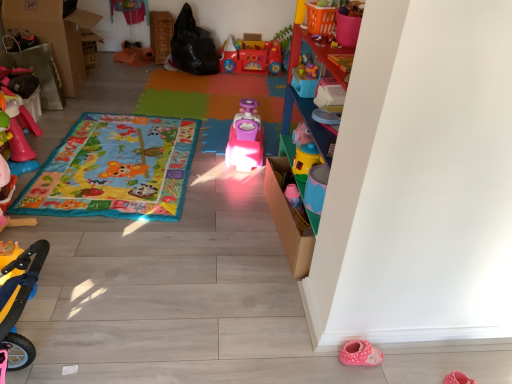
Find the location of a particular element. The height and width of the screenshot is (384, 512). free spot below matte pink car at center, arranged as the second blanket when viewed from the front (from a real-world perspective) is located at coordinates (209, 102).